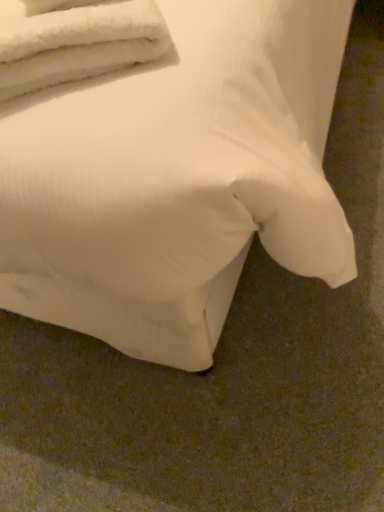
Question: From the image's perspective, does white fabric bed at center appear lower than white fluffy towels at upper left?

Choices:
 (A) no
 (B) yes

Answer: (A)

Question: Is white fluffy towels at upper left at the back of white fabric bed at center?

Choices:
 (A) yes
 (B) no

Answer: (B)

Question: Is white fabric bed at center to the right of white fluffy towels at upper left from the viewer's perspective?

Choices:
 (A) no
 (B) yes

Answer: (B)

Question: Is white fabric bed at center not near white fluffy towels at upper left?

Choices:
 (A) yes
 (B) no

Answer: (B)

Question: From the image's perspective, would you say white fabric bed at center is positioned over white fluffy towels at upper left?

Choices:
 (A) yes
 (B) no

Answer: (A)

Question: Is white fabric bed at center not within white fluffy towels at upper left?

Choices:
 (A) no
 (B) yes

Answer: (B)

Question: From a real-world perspective, is white fluffy towels at upper left positioned under white fabric bed at center based on gravity?

Choices:
 (A) no
 (B) yes

Answer: (A)

Question: From the image's perspective, is white fluffy towels at upper left under white fabric bed at center?

Choices:
 (A) yes
 (B) no

Answer: (A)

Question: Is white fluffy towels at upper left turned away from white fabric bed at center?

Choices:
 (A) yes
 (B) no

Answer: (A)

Question: Could you tell me if white fluffy towels at upper left is turned towards white fabric bed at center?

Choices:
 (A) yes
 (B) no

Answer: (A)

Question: Considering the relative positions of white fluffy towels at upper left and white fabric bed at center in the image provided, is white fluffy towels at upper left to the right of white fabric bed at center from the viewer's perspective?

Choices:
 (A) yes
 (B) no

Answer: (B)

Question: Can we say white fluffy towels at upper left lies outside white fabric bed at center?

Choices:
 (A) no
 (B) yes

Answer: (A)

Question: Considering the positions of point (19, 209) and point (119, 26), is point (19, 209) closer or farther from the camera than point (119, 26)?

Choices:
 (A) farther
 (B) closer

Answer: (A)